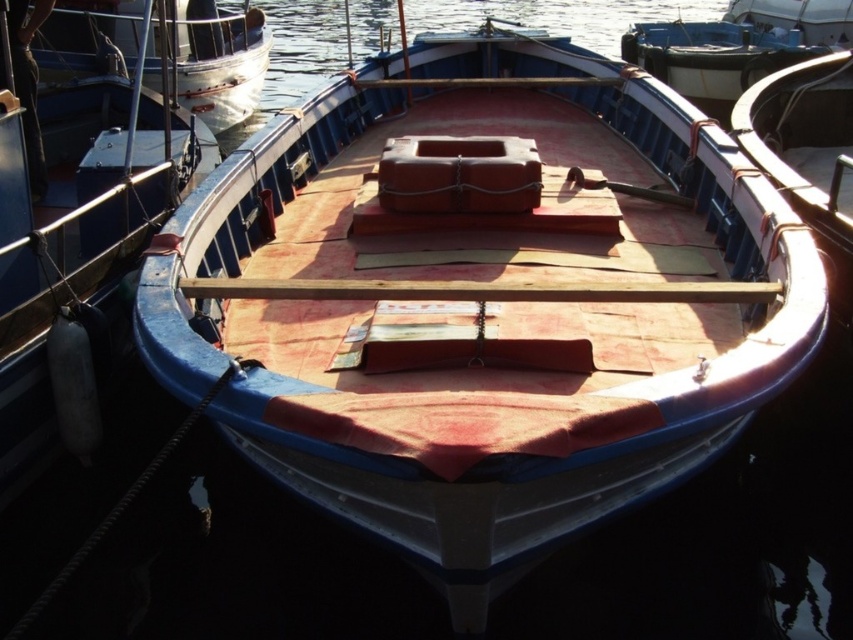
Question: Which point is farther to the camera?

Choices:
 (A) brushed metal boat at upper left
 (B) matte blue boat at center

Answer: (A)

Question: Is the position of clear water at center less distant than that of brushed metal boat at upper left?

Choices:
 (A) yes
 (B) no

Answer: (A)

Question: Does clear water at center come behind brushed metal boat at upper left?

Choices:
 (A) yes
 (B) no

Answer: (B)

Question: Considering the real-world distances, which object is closest to the matte blue boat at center?

Choices:
 (A) brushed metal boat at upper left
 (B) clear water at center

Answer: (A)

Question: Estimate the real-world distances between objects in this image. Which object is closer to the matte blue boat at center?

Choices:
 (A) clear water at center
 (B) brushed metal boat at upper left

Answer: (B)

Question: Does matte blue boat at center come in front of brushed metal boat at upper left?

Choices:
 (A) no
 (B) yes

Answer: (B)